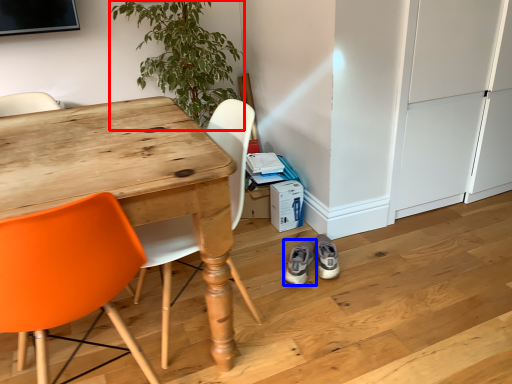
Question: Which object is further to the camera taking this photo, houseplant (highlighted by a red box) or footwear (highlighted by a blue box)?

Choices:
 (A) houseplant
 (B) footwear

Answer: (A)